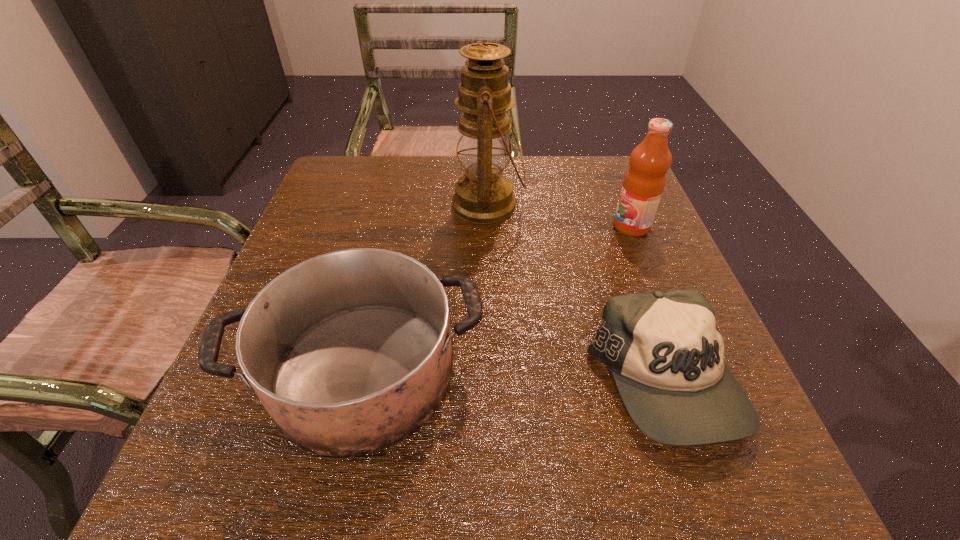
I want to click on the tallest object, so click(483, 195).

I want to click on fruit juice, so [x=644, y=182].

Locate an element on the screen. Image resolution: width=960 pixels, height=540 pixels. the second shortest object is located at coordinates (349, 352).

Identify the location of baseball cap. This screenshot has width=960, height=540. (665, 352).

Locate an element on the screen. The width and height of the screenshot is (960, 540). free spot located 0.290m on the left of the oil lamp is located at coordinates (329, 205).

At what (x,y) coordinates should I click in order to perform the action: click on free point located 0.390m on the front label of the fruit juice. Please return your answer as a coordinate pair (x, y). Looking at the image, I should click on (439, 226).

Locate an element on the screen. This screenshot has width=960, height=540. vacant space located 0.380m on the front label of the fruit juice is located at coordinates (444, 226).

You are a GUI agent. You are given a task and a screenshot of the screen. Output one action in this format:
    pyautogui.click(x=<x>, y=<y>)
    Task: Click on the free region located on the front label of the fruit juice
    The height and width of the screenshot is (540, 960).
    Given the screenshot: What is the action you would take?
    pyautogui.click(x=434, y=226)

At what (x,y) coordinates should I click in order to perform the action: click on free point located on the right of the saucepan. Please return your answer as a coordinate pair (x, y). This screenshot has height=540, width=960. Looking at the image, I should click on (551, 372).

Where is `object that is positioned at the far edge`? This screenshot has height=540, width=960. object that is positioned at the far edge is located at coordinates (483, 195).